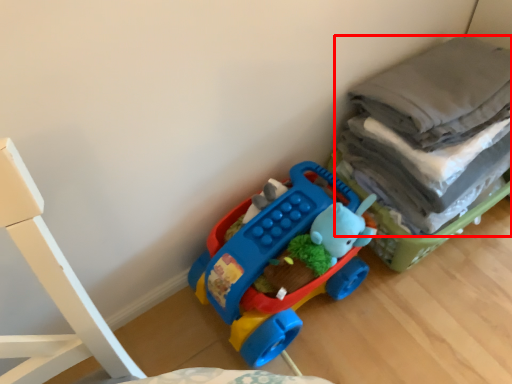
Question: Considering the relative positions of laundry (annotated by the red box) and toy in the image provided, where is laundry (annotated by the red box) located with respect to the staircase?

Choices:
 (A) left
 (B) right

Answer: (B)